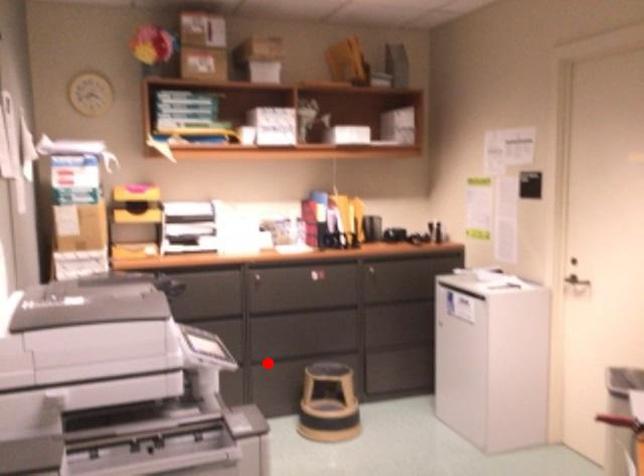
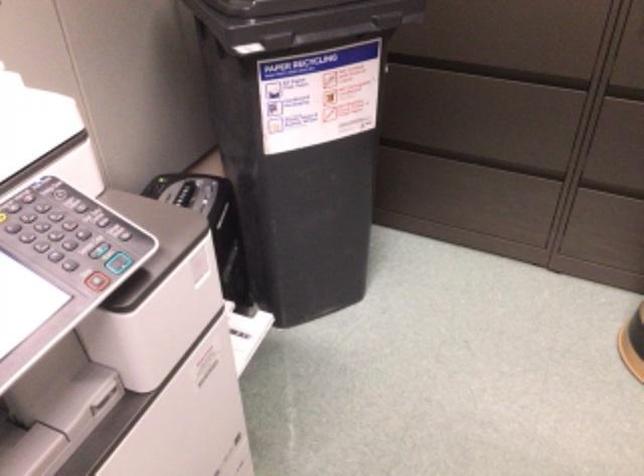
In the second image, find the point that corresponds to the highlighted location in the first image.

(614, 180)